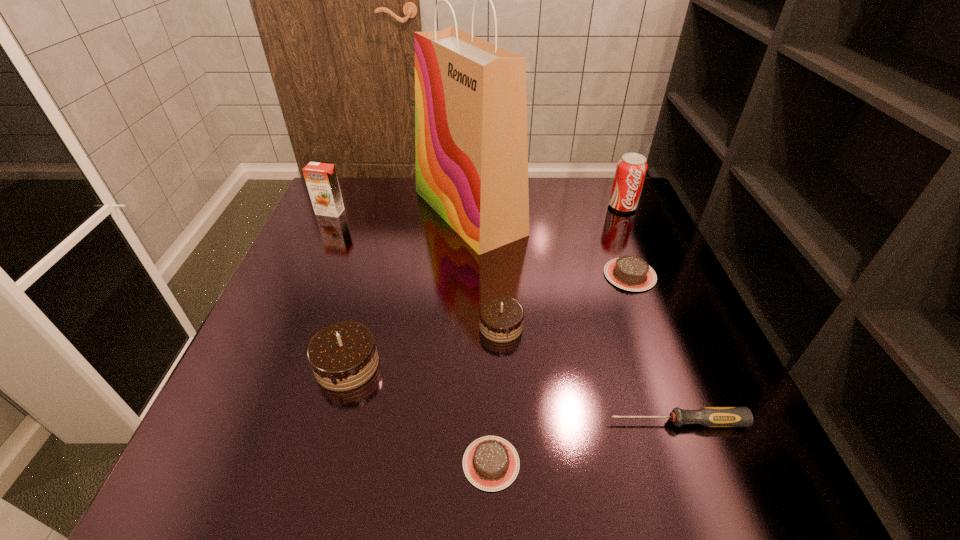
Identify which object is the fifth nearest to the soda can. Please provide its 2D coordinates. Your answer should be formatted as a tuple, i.e. [(x, y)], where the tuple contains the x and y coordinates of a point satisfying the conditions above.

[(343, 356)]

Identify the location of the second closest object to the bigger chocolate chocolate cake. (501, 318).

Locate an element on the screen. chocolate cake that is the second closest to the smaller brown chocolate cake is located at coordinates (501, 318).

Select which chocolate cake is the third closest to the shortest object. Please provide its 2D coordinates. Your answer should be formatted as a tuple, i.e. [(x, y)], where the tuple contains the x and y coordinates of a point satisfying the conditions above.

[(631, 273)]